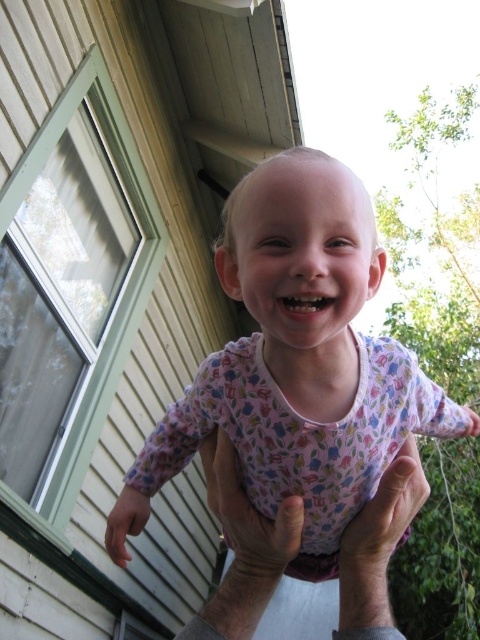
You are a photographer trying to capture the perfect shot of the child in pink floral pajamas at center and the adult with skinny white hands at lower center. To ensure both subjects are in focus, you need to know their relative sizes. Based on the scene, which object is wider?

The pink floral pajamas at center might be wider than the skinny white hands at lower center.

You are a photographer trying to capture a candid shot of the child in pink floral pajamas at center and the adult with skinny white hands at lower center. If you want to ensure both subjects are in focus, which part of the image should you focus on first?

The pink floral pajamas at center is taller than the skinny white hands at lower center, so focusing on the pink floral pajamas at center first would ensure both subjects are in focus since it is farther away from the camera.

A child is being held up by an adult in a scene. The adult is standing near a house with a window. There is a point at coordinates point (260, 369). If the adult wants to place the child gently on the ground, how far in inches would the adult need to lower the child to reach the ground?

The adult needs to lower the child by 28.61 inches to reach the ground because the distance between the child and the ground is 28.61 inches according to the coordinates provided.